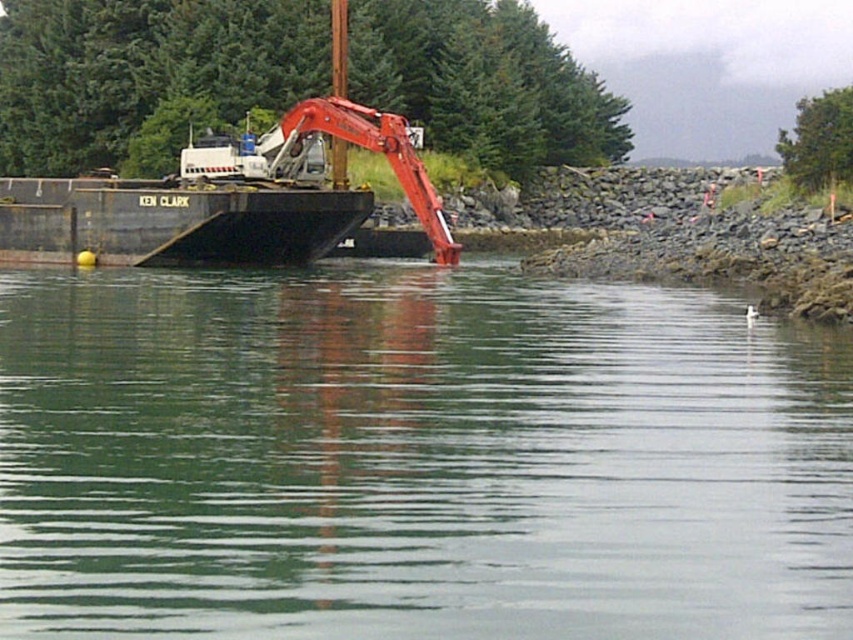
You are a safety inspector observing the construction site. You notice the green smooth water at center and the matte red excavator at center. Which object is positioned closer to your viewpoint?

The green smooth water at center is closer to the viewer than the matte red excavator at center.

You are a crane operator standing on the deck of the KEN CLARK barge. You need to lower a heavy load into the water. The load is 10 meters long. Can you safely lower it between the green smooth water at center and the matte red excavator at center without hitting either object?

The distance between the green smooth water at center and the matte red excavator at center is 20.22 meters. Since the load is 10 meters long, it can be safely lowered between them as there is sufficient space.